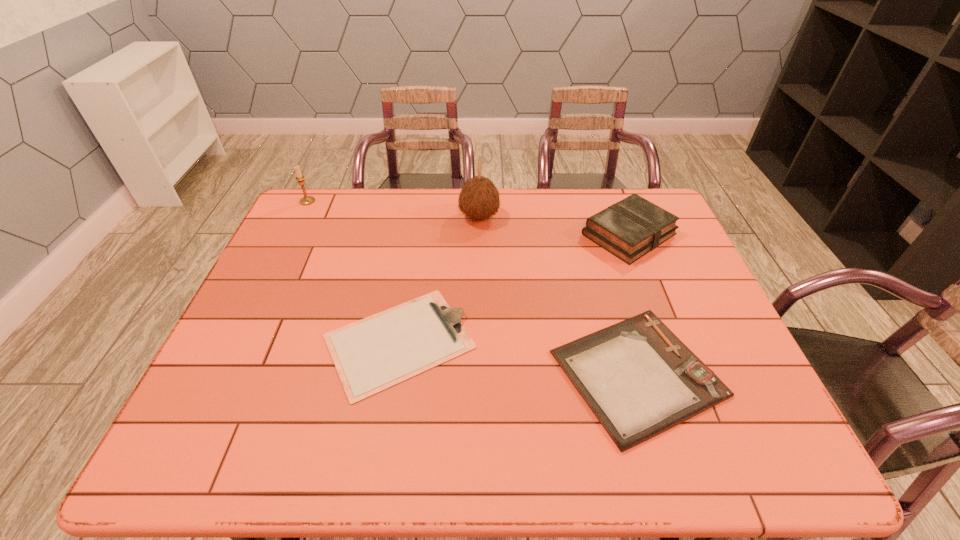
I want to click on free space located on the left of the right clipboard, so click(x=475, y=373).

The image size is (960, 540). In order to click on coconut that is at the far edge in this screenshot , I will do `click(479, 198)`.

Find the location of a particular element. candle holder situated at the far edge is located at coordinates (306, 200).

At what (x,y) coordinates should I click in order to perform the action: click on book at the far edge. Please return your answer as a coordinate pair (x, y). Looking at the image, I should click on (629, 229).

Locate an element on the screen. Image resolution: width=960 pixels, height=540 pixels. object located in the near edge section of the desktop is located at coordinates (639, 379).

Find the location of a particular element. object present at the left edge is located at coordinates (306, 200).

At what (x,y) coordinates should I click in order to perform the action: click on book at the right edge. Please return your answer as a coordinate pair (x, y). Looking at the image, I should click on (629, 229).

This screenshot has height=540, width=960. In order to click on clipboard situated at the right edge in this screenshot , I will do `click(639, 379)`.

Where is `object located in the far left corner section of the desktop`? The height and width of the screenshot is (540, 960). object located in the far left corner section of the desktop is located at coordinates (306, 200).

You are a GUI agent. You are given a task and a screenshot of the screen. Output one action in this format:
    pyautogui.click(x=<x>, y=<y>)
    Task: Click on the object at the far right corner
    The image size is (960, 540).
    Given the screenshot: What is the action you would take?
    pyautogui.click(x=629, y=229)